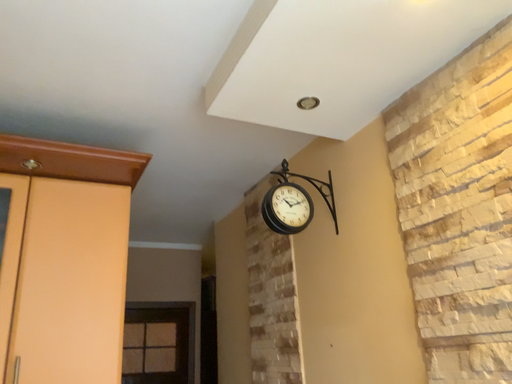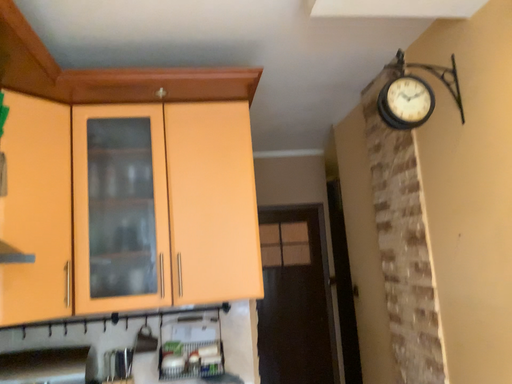
Question: Which way did the camera rotate in the video?

Choices:
 (A) rotated downward
 (B) rotated upward

Answer: (A)